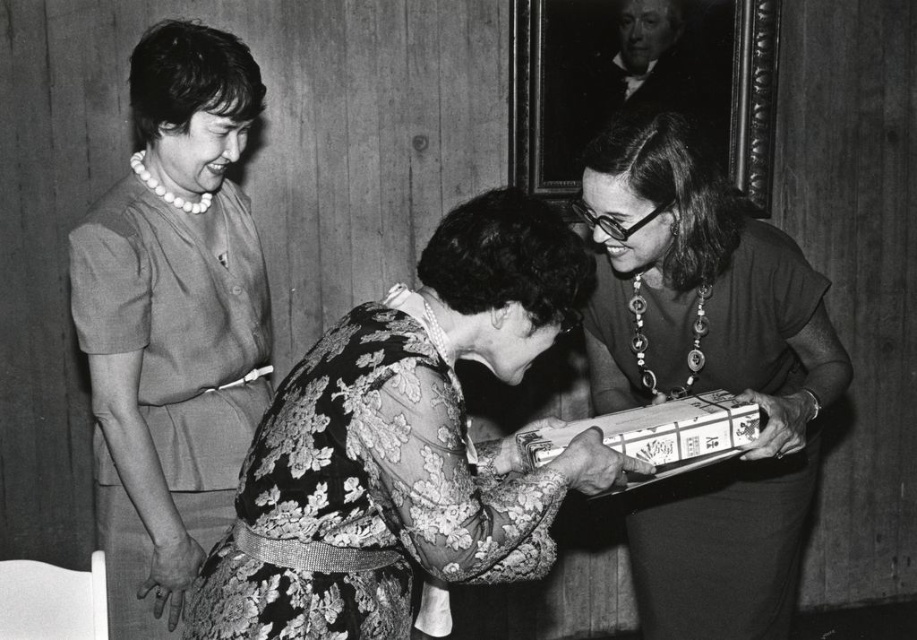
You are a guest at a formal event and see the pearl necklace at upper left and the matte black box at center. Which object is positioned higher in the image?

The pearl necklace at upper left is positioned higher than the matte black box at center.